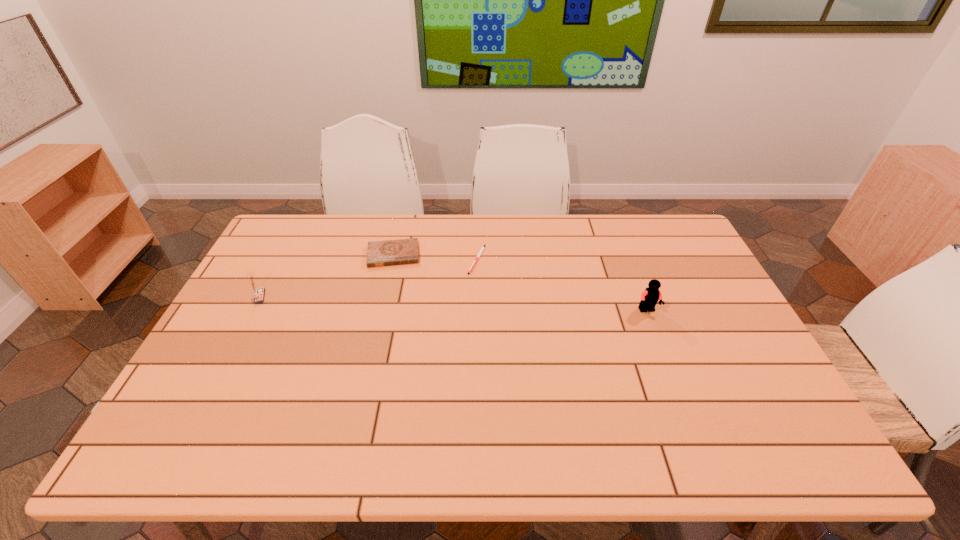
Locate an element on the screen. vacant space at the near edge of the desktop is located at coordinates (533, 410).

You are a GUI agent. You are given a task and a screenshot of the screen. Output one action in this format:
    pyautogui.click(x=<x>, y=<y>)
    Task: Click on the free space at the left edge of the desktop
    This screenshot has width=960, height=540.
    Given the screenshot: What is the action you would take?
    pyautogui.click(x=223, y=322)

Locate an element on the screen. vacant space at the right edge of the desktop is located at coordinates click(x=684, y=327).

Locate an element on the screen. The height and width of the screenshot is (540, 960). vacant space at the far right corner is located at coordinates (662, 252).

At what (x,y) coordinates should I click in order to perform the action: click on vacant area that lies between the pen and the nearest object. Please return your answer as a coordinate pair (x, y). Looking at the image, I should click on tap(563, 285).

Identify the location of empty space between the shortest object and the diary. This screenshot has width=960, height=540. (435, 257).

Locate an element on the screen. This screenshot has width=960, height=540. free space between the rightmost object and the shortest object is located at coordinates (563, 285).

You are a GUI agent. You are given a task and a screenshot of the screen. Output one action in this format:
    pyautogui.click(x=<x>, y=<y>)
    Task: Click on the vacant space that is in between the second shortest object and the matchbox
    The image size is (960, 540).
    Given the screenshot: What is the action you would take?
    pyautogui.click(x=326, y=276)

What are the coordinates of `free space between the third tallest object and the leftmost object` in the screenshot? It's located at (326, 276).

The image size is (960, 540). I want to click on vacant area that lies between the matchbox and the nearest object, so click(453, 303).